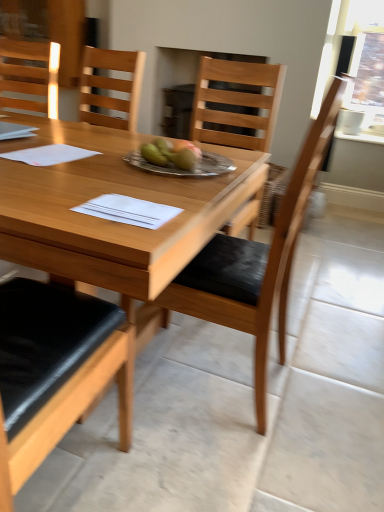
Question: Can you confirm if wooden chair at center, marked as the second chair in a top-to-bottom arrangement, is taller than matte wood chair at upper left, the second chair viewed from the right?

Choices:
 (A) no
 (B) yes

Answer: (B)

Question: Can you confirm if wooden chair at center, the first chair ordered from the bottom, is bigger than matte wood chair at upper left, which appears as the 1th chair when viewed from the left?

Choices:
 (A) no
 (B) yes

Answer: (B)

Question: Is wooden chair at center, marked as the second chair in a top-to-bottom arrangement, in front of matte wood chair at upper left, which appears as the 2th chair when ordered from the bottom?

Choices:
 (A) yes
 (B) no

Answer: (A)

Question: Is wooden chair at center, marked as the second chair in a top-to-bottom arrangement, wider than matte wood chair at upper left, the second chair viewed from the right?

Choices:
 (A) yes
 (B) no

Answer: (A)

Question: From the image's perspective, is wooden chair at center, the first chair ordered from the bottom, below matte wood chair at upper left, which appears as the 2th chair when ordered from the bottom?

Choices:
 (A) no
 (B) yes

Answer: (B)

Question: From a real-world perspective, is wooden table at center positioned above or below white paper at center?

Choices:
 (A) above
 (B) below

Answer: (B)

Question: From the image's perspective, relative to white paper at center, is wooden table at center above or below?

Choices:
 (A) above
 (B) below

Answer: (B)

Question: Would you say wooden table at center is to the left or to the right of white paper at center in the picture?

Choices:
 (A) right
 (B) left

Answer: (B)

Question: Is point (175, 273) positioned closer to the camera than point (160, 214)?

Choices:
 (A) closer
 (B) farther

Answer: (B)

Question: Is point (4, 61) closer or farther from the camera than point (195, 175)?

Choices:
 (A) closer
 (B) farther

Answer: (B)

Question: Is matte wood chair at upper left, which appears as the 2th chair when ordered from the bottom, inside or outside of silver metallic plate at center?

Choices:
 (A) inside
 (B) outside

Answer: (B)

Question: In the image, is matte wood chair at upper left, the second chair in the front-to-back sequence, positioned in front of or behind silver metallic plate at center?

Choices:
 (A) front
 (B) behind

Answer: (B)

Question: Considering the positions of matte wood chair at upper left, placed as the first chair when sorted from top to bottom, and silver metallic plate at center in the image, is matte wood chair at upper left, placed as the first chair when sorted from top to bottom, bigger or smaller than silver metallic plate at center?

Choices:
 (A) small
 (B) big

Answer: (B)

Question: Considering the positions of wooden chair at center, the 2th chair in the left-to-right sequence, and matte wood chair at upper left, which appears as the 1th chair when viewed from the left, in the image, is wooden chair at center, the 2th chair in the left-to-right sequence, wider or thinner than matte wood chair at upper left, which appears as the 1th chair when viewed from the left,?

Choices:
 (A) wide
 (B) thin

Answer: (A)

Question: Considering the positions of wooden chair at center, marked as the second chair in a top-to-bottom arrangement, and matte wood chair at upper left, the second chair viewed from the right, in the image, is wooden chair at center, marked as the second chair in a top-to-bottom arrangement, taller or shorter than matte wood chair at upper left, the second chair viewed from the right,?

Choices:
 (A) short
 (B) tall

Answer: (B)